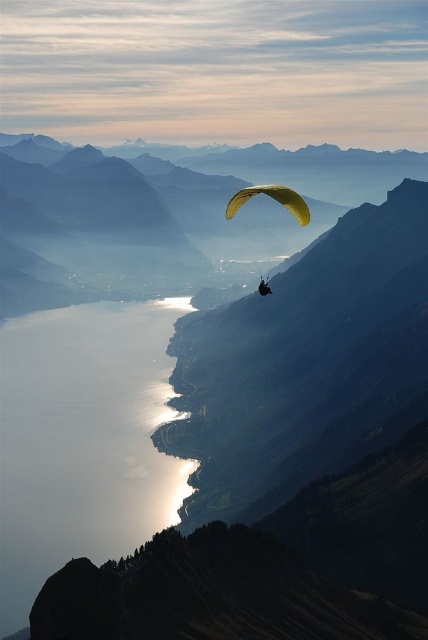
Does silvery reflective water at lower left have a lesser height compared to yellow fabric parachute at center?

No.

Who is shorter, silvery reflective water at lower left or yellow fabric parachute at center?

With less height is yellow fabric parachute at center.

Is point (67, 456) positioned before point (232, 200)?

No, (67, 456) is further to viewer.

What are the coordinates of `silvery reflective water at lower left` in the screenshot? It's located at (83, 440).

Can you confirm if yellow fabric parachute at center is taller than matte yellow paraglider at center?

Indeed, yellow fabric parachute at center has a greater height compared to matte yellow paraglider at center.

Is point (225, 212) positioned after point (261, 280)?

Yes, point (225, 212) is behind point (261, 280).

Find the location of a particular element. This screenshot has height=640, width=428. yellow fabric parachute at center is located at coordinates (273, 198).

Who is higher up, silvery reflective water at lower left or matte yellow paraglider at center?

matte yellow paraglider at center is higher up.

Between point (128, 465) and point (261, 289), which one is positioned in front?

Point (261, 289)

This screenshot has width=428, height=640. I want to click on silvery reflective water at lower left, so click(x=83, y=440).